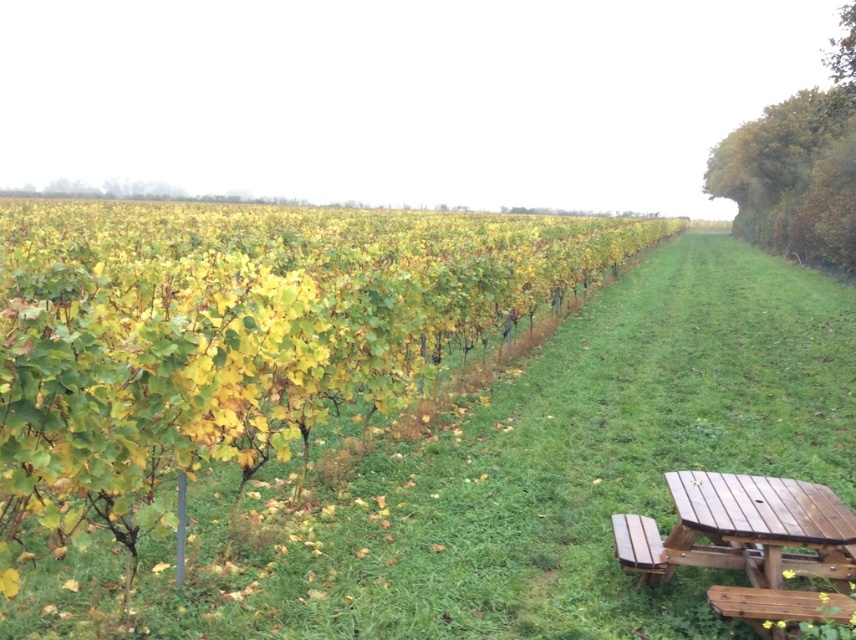
Question: Does green grassy at center appear on the left side of wooden picnic table at lower right?

Choices:
 (A) no
 (B) yes

Answer: (A)

Question: Which of the following is the farthest from the observer?

Choices:
 (A) (265, 570)
 (B) (638, 566)

Answer: (A)

Question: Which point is farther to the camera?

Choices:
 (A) green grassy at center
 (B) wooden bench at lower right

Answer: (B)

Question: From the image, what is the correct spatial relationship of green grassy at center in relation to wooden picnic table at lower right?

Choices:
 (A) left
 (B) right

Answer: (B)

Question: Considering the relative positions of green grassy at center and wooden picnic table at lower right in the image provided, where is green grassy at center located with respect to wooden picnic table at lower right?

Choices:
 (A) left
 (B) right

Answer: (B)

Question: Which point appears closest to the camera in this image?

Choices:
 (A) (500, 497)
 (B) (622, 532)
 (C) (638, 518)

Answer: (B)